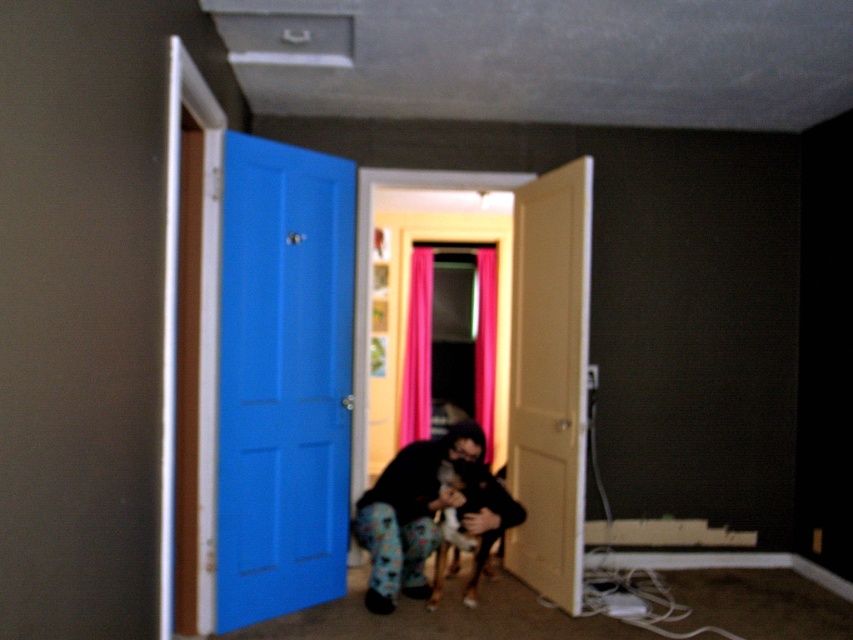
Question: Can you confirm if blue painted door at left is positioned to the left of matte yellow door at center?

Choices:
 (A) no
 (B) yes

Answer: (B)

Question: Can you confirm if blue painted door at left is thinner than fluffy brown dog at lower center?

Choices:
 (A) no
 (B) yes

Answer: (A)

Question: Which of these objects is positioned farthest from the blue painted door at left?

Choices:
 (A) fluffy brown dog at lower center
 (B) matte yellow door at center
 (C) fluffy fur dog at center

Answer: (B)

Question: Among these points, which one is nearest to the camera?

Choices:
 (A) (440, 586)
 (B) (271, 387)
 (C) (486, 513)
 (D) (570, 321)

Answer: (B)

Question: Can you confirm if matte yellow door at center is positioned below fluffy fur dog at center?

Choices:
 (A) yes
 (B) no

Answer: (B)

Question: Which of the following is the closest to the observer?

Choices:
 (A) fluffy brown dog at lower center
 (B) blue painted door at left
 (C) fluffy fur dog at center

Answer: (B)